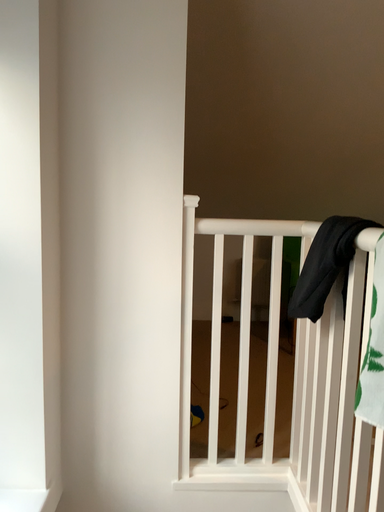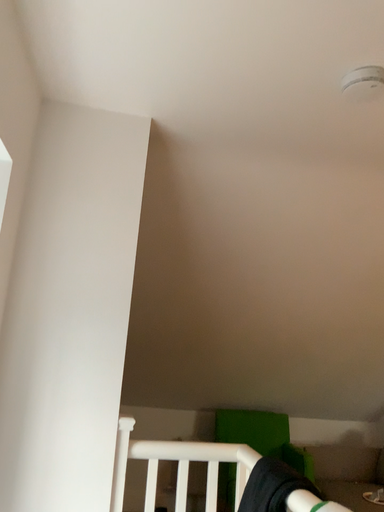
Question: Which way did the camera rotate in the video?

Choices:
 (A) rotated left
 (B) rotated right

Answer: (B)